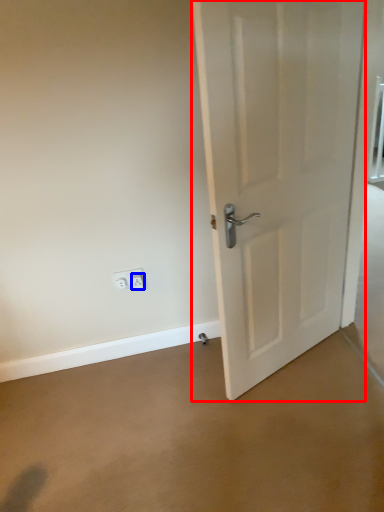
Question: Which point is closer to the camera, door (highlighted by a red box) or electric outlet (highlighted by a blue box)?

Choices:
 (A) door
 (B) electric outlet

Answer: (A)